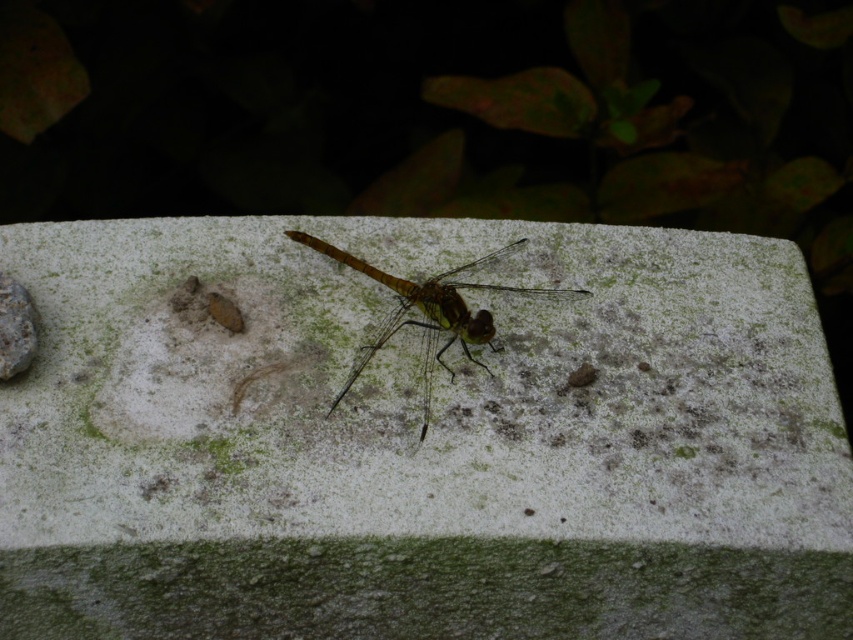
Where is `white rough concrete at center`? This screenshot has height=640, width=853. white rough concrete at center is located at coordinates (421, 444).

Is white rough concrete at center thinner than translucent yellow-green dragonfly at center?

No.

Does point (761, 356) come closer to viewer compared to point (428, 307)?

Yes, it is in front of point (428, 307).

Where is `white rough concrete at center`? The height and width of the screenshot is (640, 853). white rough concrete at center is located at coordinates (421, 444).